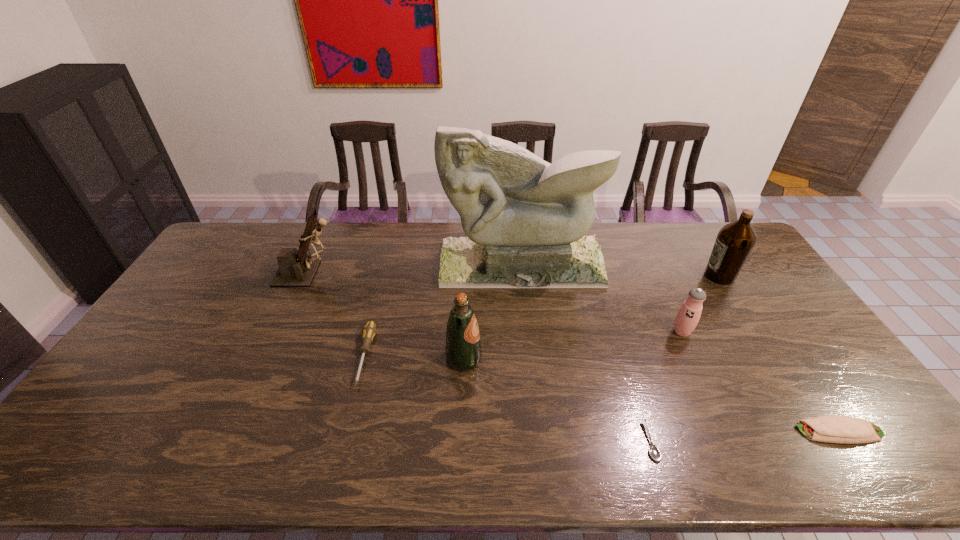
I want to click on blank space at the right edge of the desktop, so click(x=789, y=375).

You are a GUI agent. You are given a task and a screenshot of the screen. Output one action in this format:
    pyautogui.click(x=<x>, y=<y>)
    Task: Click on the vacant area at the far left corner
    
    Given the screenshot: What is the action you would take?
    pyautogui.click(x=211, y=252)

The image size is (960, 540). Find the location of `vacant space at the near left corner of the desktop`. vacant space at the near left corner of the desktop is located at coordinates (109, 465).

This screenshot has height=540, width=960. Find the location of `free space between the screwdriver and the third object from right to left`. free space between the screwdriver and the third object from right to left is located at coordinates (523, 344).

Locate an element on the screen. This screenshot has height=540, width=960. vacant point located between the left olive oil and the seventh tallest object is located at coordinates (652, 395).

Image resolution: width=960 pixels, height=540 pixels. I want to click on vacant area that lies between the tallest object and the second object from left to right, so click(444, 310).

Where is `empty space between the third shortest object and the sculpture`? The height and width of the screenshot is (540, 960). empty space between the third shortest object and the sculpture is located at coordinates (444, 310).

The height and width of the screenshot is (540, 960). What are the coordinates of `empty space between the shortest object and the sculpture` in the screenshot? It's located at pos(586,353).

At what (x,y) coordinates should I click in order to perform the action: click on vacant space in between the left olive oil and the right olive oil. Please return your answer as a coordinate pair (x, y). This screenshot has height=540, width=960. Looking at the image, I should click on (591, 318).

You are a GUI agent. You are given a task and a screenshot of the screen. Output one action in this format:
    pyautogui.click(x=<x>, y=<y>)
    Task: Click on the free space between the soupspoon and the second shortest object
    
    Given the screenshot: What is the action you would take?
    pyautogui.click(x=745, y=436)